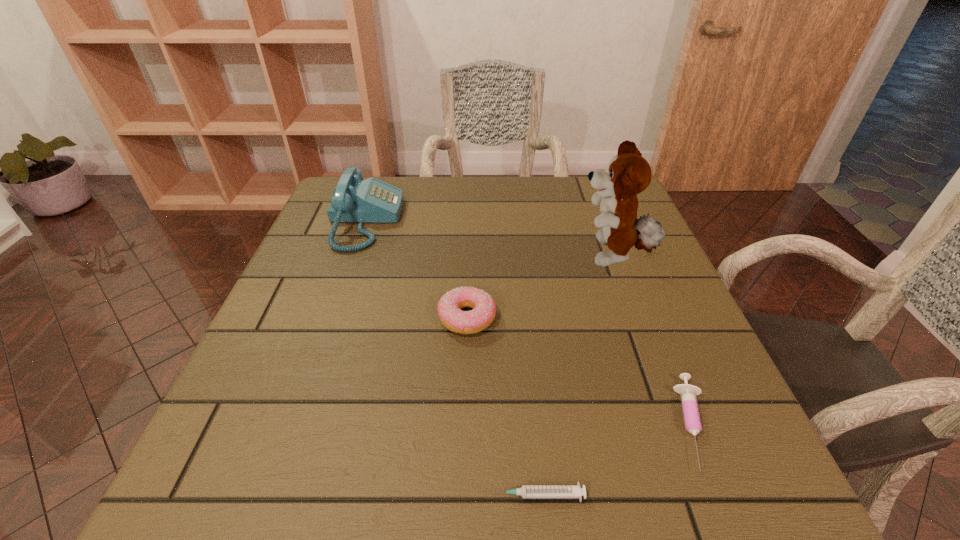
Locate an element on the screen. The height and width of the screenshot is (540, 960). free space between the telephone and the third shortest object is located at coordinates (416, 269).

Find the location of a particular element. The image size is (960, 540). vacant space that's between the third shortest object and the nearest object is located at coordinates (502, 407).

You are a GUI agent. You are given a task and a screenshot of the screen. Output one action in this format:
    pyautogui.click(x=<x>, y=<y>)
    Task: Click on the vacant space that is in between the second tallest object and the puppy
    
    Given the screenshot: What is the action you would take?
    pyautogui.click(x=489, y=239)

The height and width of the screenshot is (540, 960). What are the coordinates of `vacant region between the shorter syringe and the second shortest object` in the screenshot? It's located at (615, 460).

I want to click on vacant region between the telephone and the puppy, so click(489, 239).

The height and width of the screenshot is (540, 960). Find the location of `free spot between the leftmost object and the third tallest object`. free spot between the leftmost object and the third tallest object is located at coordinates (416, 269).

Locate an element on the screen. This screenshot has width=960, height=540. free spot between the nearest object and the fourth tallest object is located at coordinates (615, 460).

This screenshot has height=540, width=960. In order to click on free space between the puppy and the nearer syringe in this screenshot , I will do `click(575, 376)`.

Locate an element on the screen. The width and height of the screenshot is (960, 540). object that is the second closest to the third tallest object is located at coordinates (628, 173).

Locate which object ranks in proximity to the fourth tallest object. Please provide its 2D coordinates. Your answer should be formatted as a tuple, i.e. [(x, y)], where the tuple contains the x and y coordinates of a point satisfying the conditions above.

[(526, 491)]